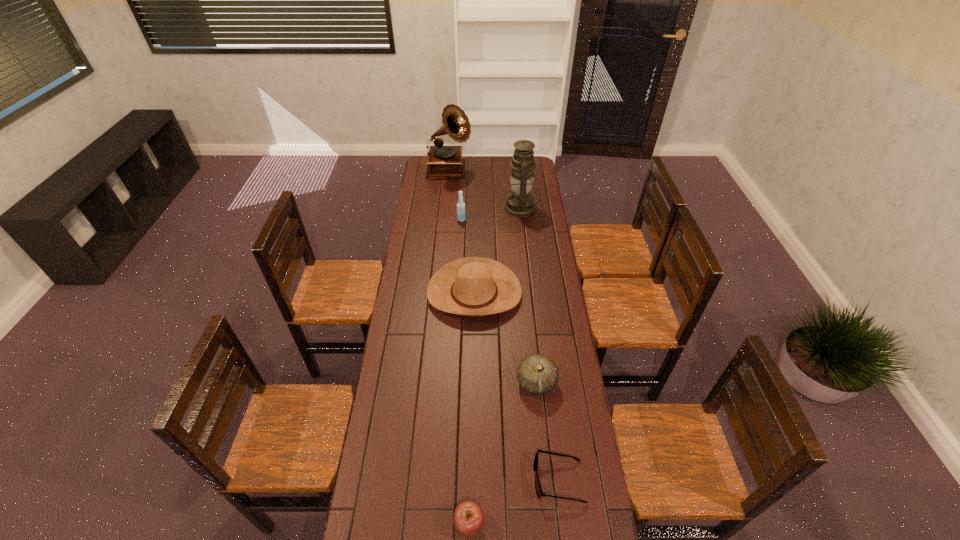
Where is `free space between the fourth tallest object and the third tallest object`? free space between the fourth tallest object and the third tallest object is located at coordinates (468, 256).

This screenshot has width=960, height=540. Find the location of `unoccupied area between the shortest object and the third shortest object`. unoccupied area between the shortest object and the third shortest object is located at coordinates (547, 431).

Identify which object is located as the fifth nearest to the oil lamp. Please provide its 2D coordinates. Your answer should be formatted as a tuple, i.e. [(x, y)], where the tuple contains the x and y coordinates of a point satisfying the conditions above.

[(538, 488)]

Point out which object is positioned as the third nearest to the third shortest object. Please provide its 2D coordinates. Your answer should be formatted as a tuple, i.e. [(x, y)], where the tuple contains the x and y coordinates of a point satisfying the conditions above.

[(468, 519)]

Identify the location of free location that satisfies the following two spatial constraints: 1. on the front-facing side of the gourd; 2. on the right side of the cowboy hat. The image size is (960, 540). (473, 382).